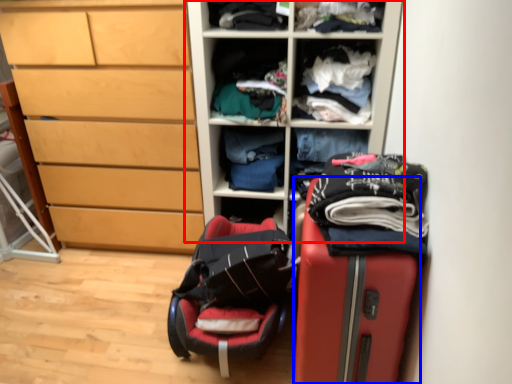
Question: Among these objects, which one is nearest to the camera, cupboard (highlighted by a red box) or suitcase (highlighted by a blue box)?

Choices:
 (A) cupboard
 (B) suitcase

Answer: (B)